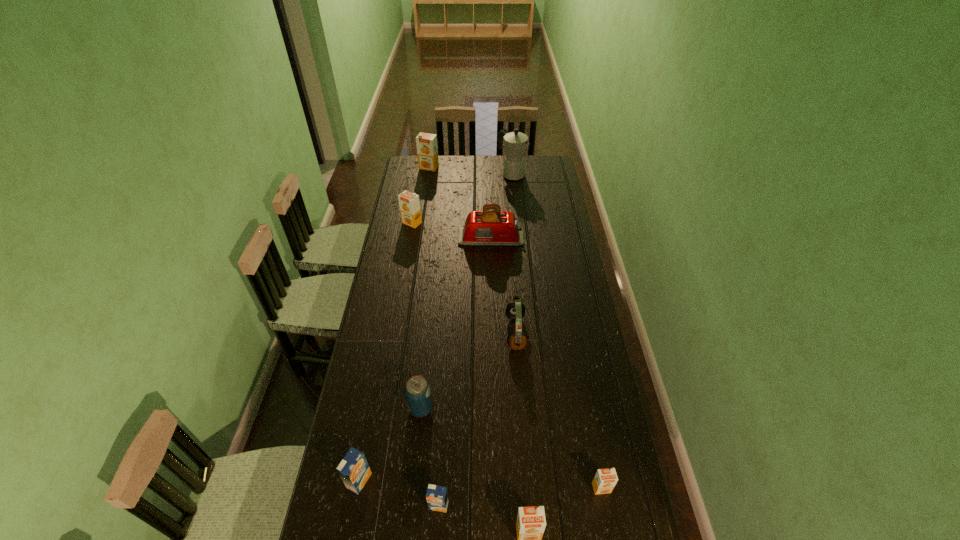
Locate which object ranks eighth in proximity to the left blue orange_juice. Please provide its 2D coordinates. Your answer should be formatted as a tuple, i.e. [(x, y)], where the tuple contains the x and y coordinates of a point satisfying the conditions above.

[(516, 143)]

What are the coordinates of `object identified as the third closest to the smallest orange orange juice` in the screenshot? It's located at (515, 310).

Image resolution: width=960 pixels, height=540 pixels. Identify the location of the second closest orange_juice to the coffeepot. (409, 203).

Locate which orange_juice ranks fourth in proximity to the left blue orange_juice. Please provide its 2D coordinates. Your answer should be formatted as a tuple, i.e. [(x, y)], where the tuple contains the x and y coordinates of a point satisfying the conditions above.

[(409, 203)]

Locate an element on the screen. Image resolution: width=960 pixels, height=540 pixels. the second closest orange orange juice to the farthest orange orange juice is located at coordinates (605, 480).

Locate an element on the screen. orange orange juice that is the second closest to the third farthest orange orange juice is located at coordinates (409, 203).

Find the location of a particular element. vacant space that satisfies the following two spatial constraints: 1. on the ear cups of the headset; 2. on the front side of the sixth farthest object is located at coordinates tap(521, 408).

Find the location of a particular element. vacant space that satisfies the following two spatial constraints: 1. on the front side of the third orange_juice from right to left; 2. on the left side of the second farthest orange orange juice is located at coordinates (363, 505).

Where is `vacant space that satisfies the following two spatial constraints: 1. on the ear cups of the sixth nearest object; 2. on the left side of the rightmost orange orange juice`? vacant space that satisfies the following two spatial constraints: 1. on the ear cups of the sixth nearest object; 2. on the left side of the rightmost orange orange juice is located at coordinates (527, 488).

Identify the location of free space in the image that satisfies the following two spatial constraints: 1. on the front side of the smaller blue orange_juice; 2. on the left side of the bigger blue orange_juice. (355, 505).